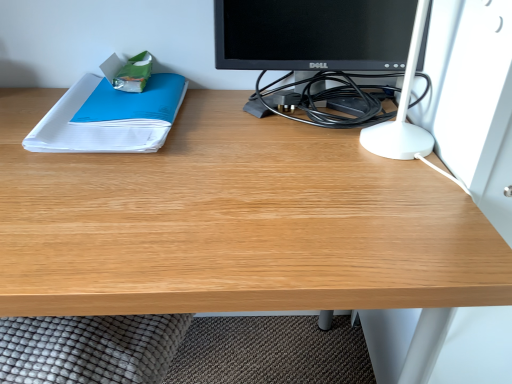
The height and width of the screenshot is (384, 512). I want to click on free location to the left of black glossy monitor at upper center, so click(x=184, y=137).